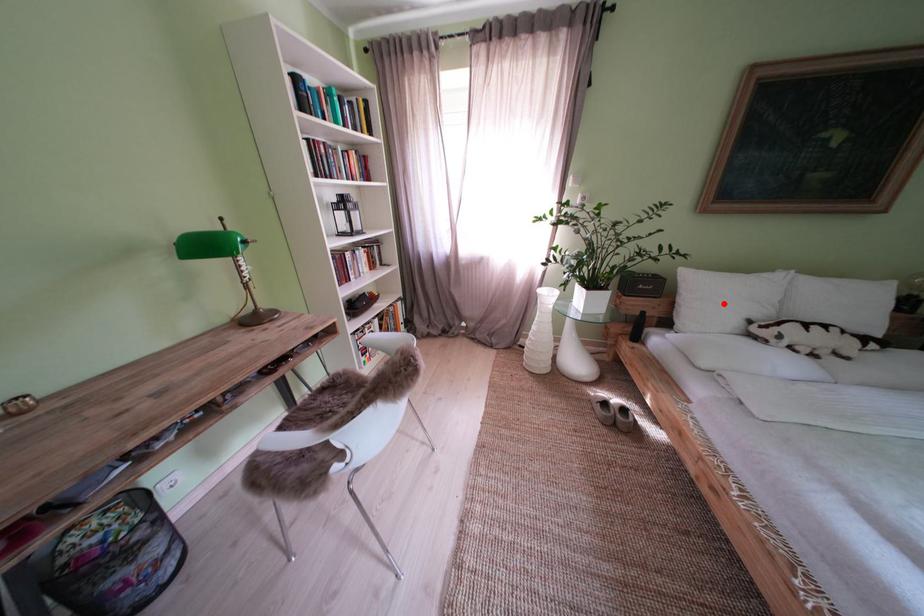
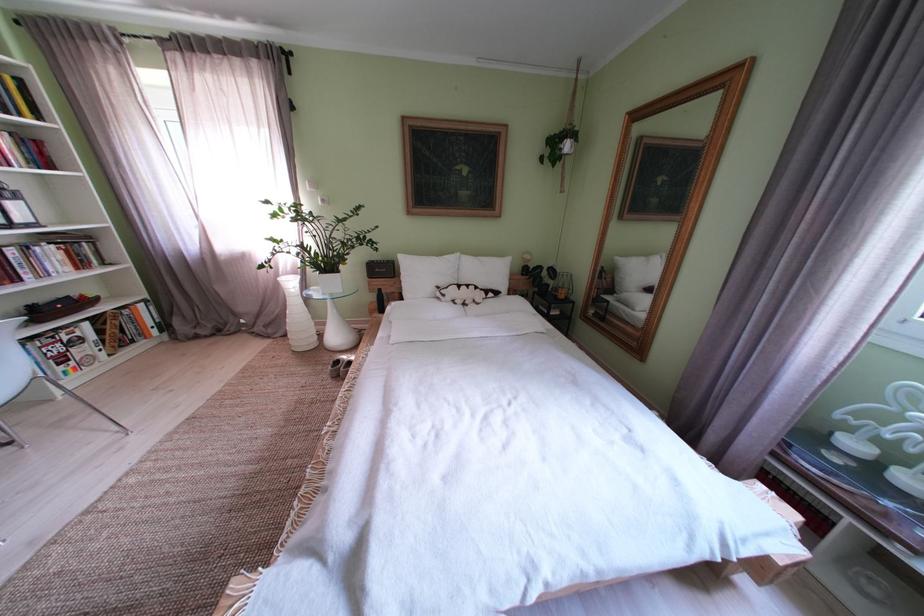
Where in the second image is the point corresponding to the highlighted location from the first image?

(429, 280)